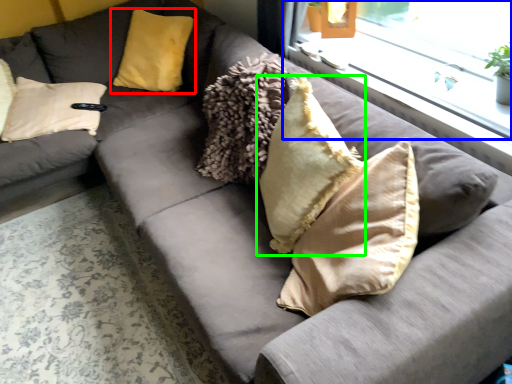
Question: Considering the real-world distances, which object is farthest from pillow (highlighted by a red box)? window (highlighted by a blue box) or pillow (highlighted by a green box)?

Choices:
 (A) window
 (B) pillow

Answer: (B)